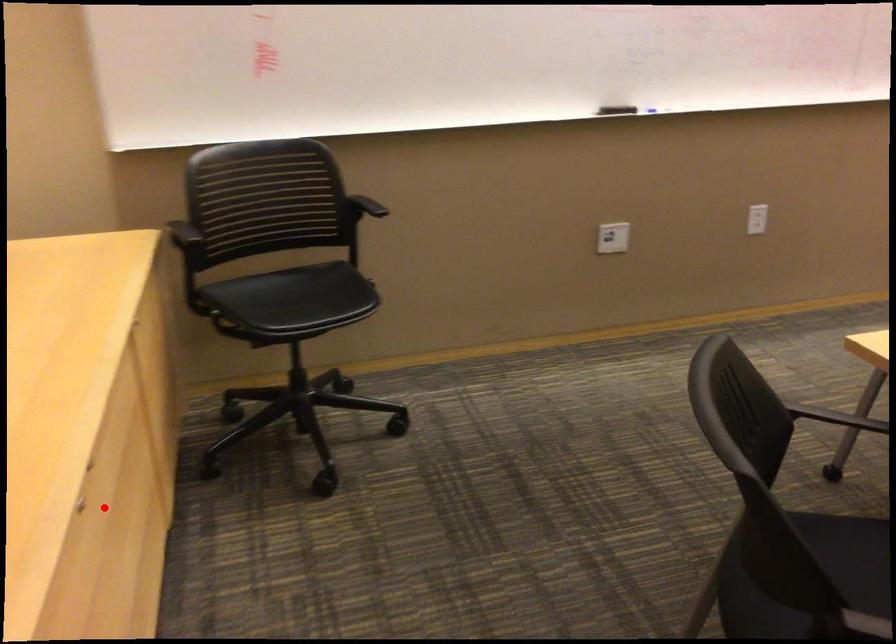
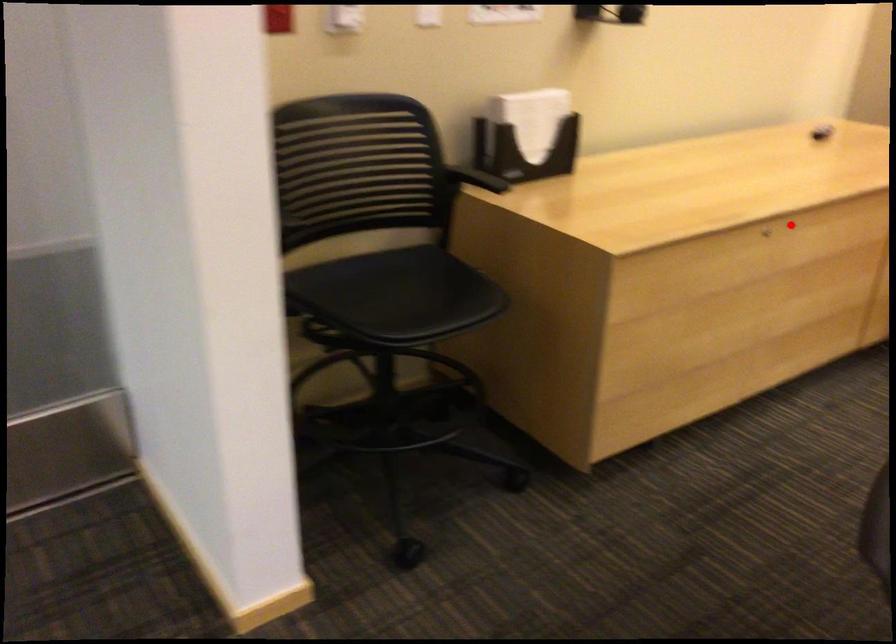
I am providing you with two images of the same scene from different viewpoints. A red point is marked on the first image and another point is marked on the second image. Is the red point in image1 aligned with the point shown in image2?

Yes